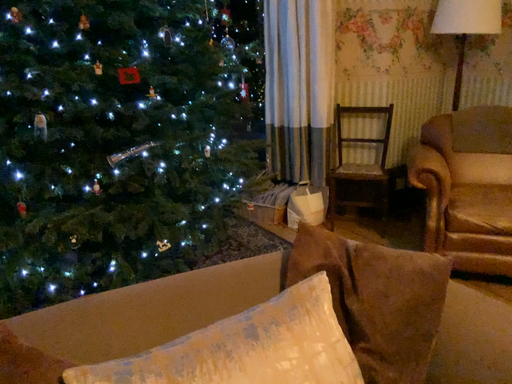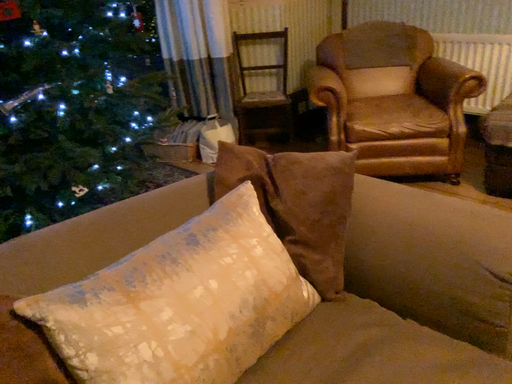
Question: How did the camera likely rotate when shooting the video?

Choices:
 (A) rotated downward
 (B) rotated upward

Answer: (A)